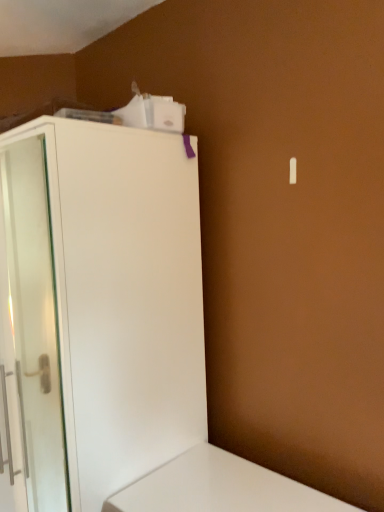
The height and width of the screenshot is (512, 384). What do you see at coordinates (35, 323) in the screenshot?
I see `white glass door at left` at bounding box center [35, 323].

Where is `white glass door at left`? Image resolution: width=384 pixels, height=512 pixels. white glass door at left is located at coordinates (35, 323).

Locate an element on the screen. Image resolution: width=384 pixels, height=512 pixels. white glass door at left is located at coordinates (35, 323).